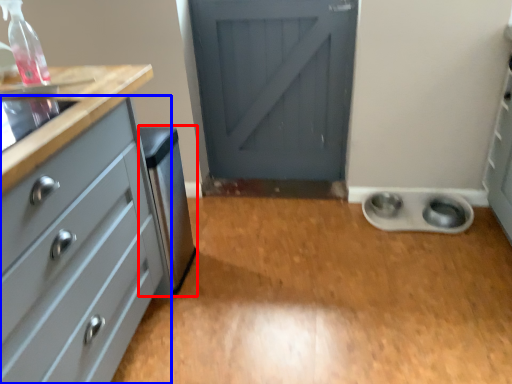
Question: Which of the following is the closest to the observer, appliance (highlighted by a red box) or chest of drawers (highlighted by a blue box)?

Choices:
 (A) appliance
 (B) chest of drawers

Answer: (B)